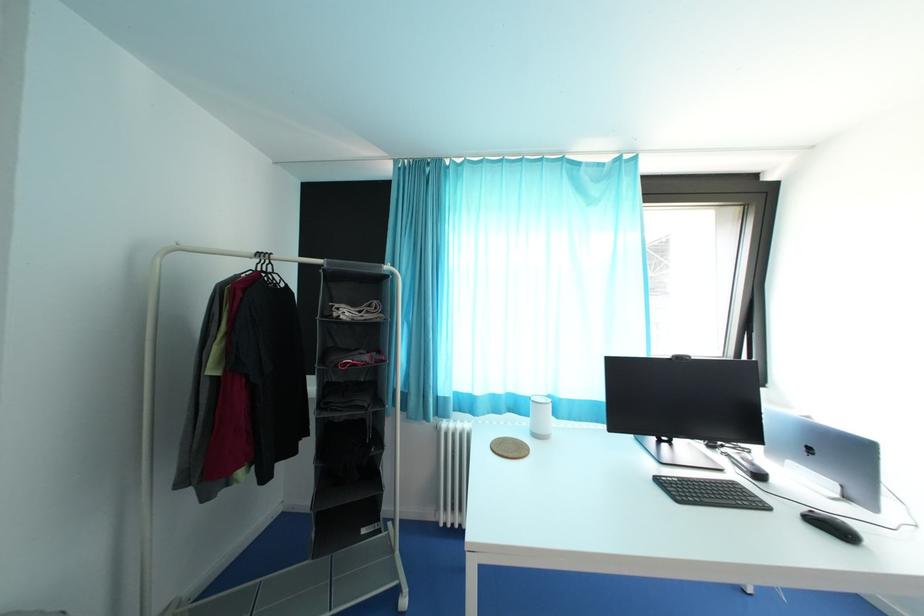
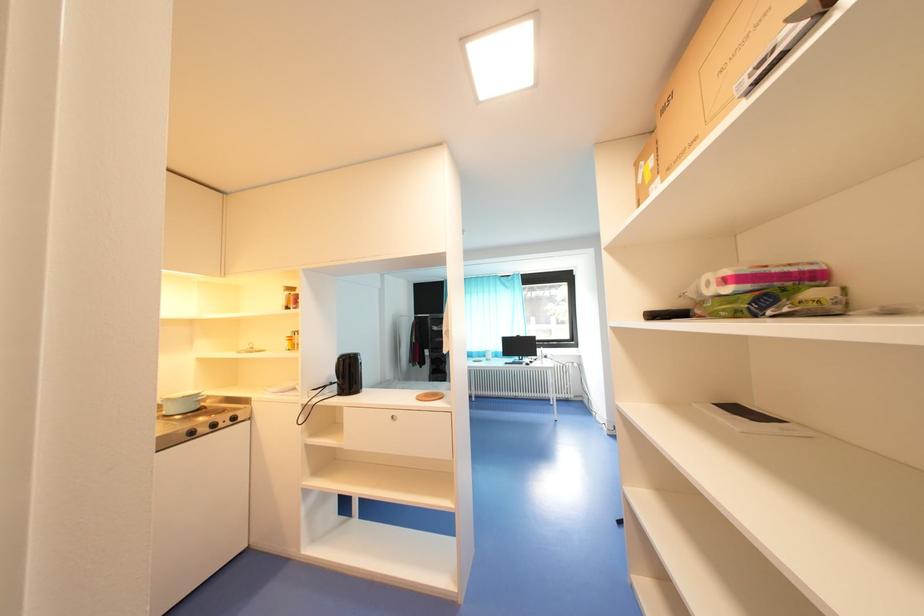
Question: In a continuous first-person perspective shot, in which direction is the camera moving?

Choices:
 (A) Left
 (B) Right
 (C) Forward
 (D) Backward

Answer: (D)